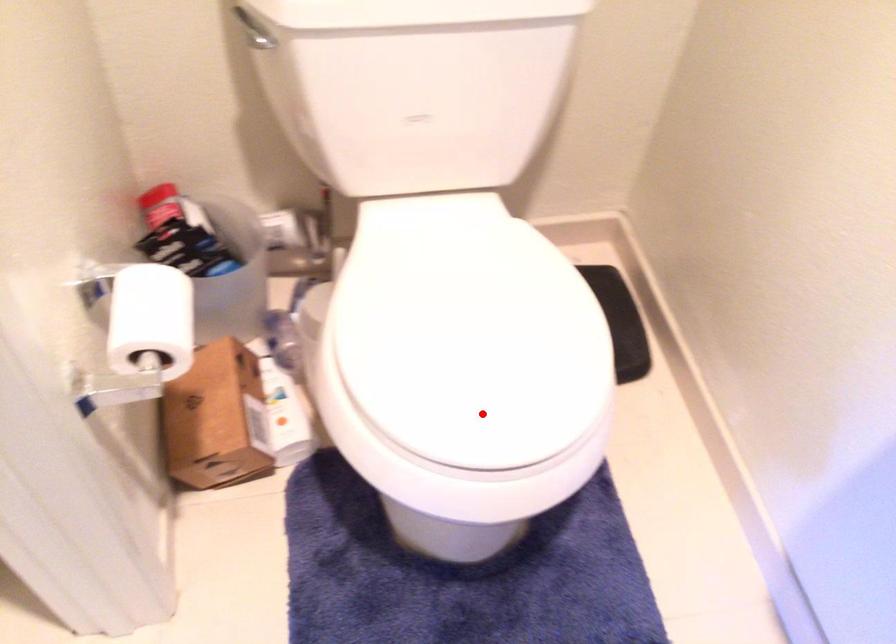
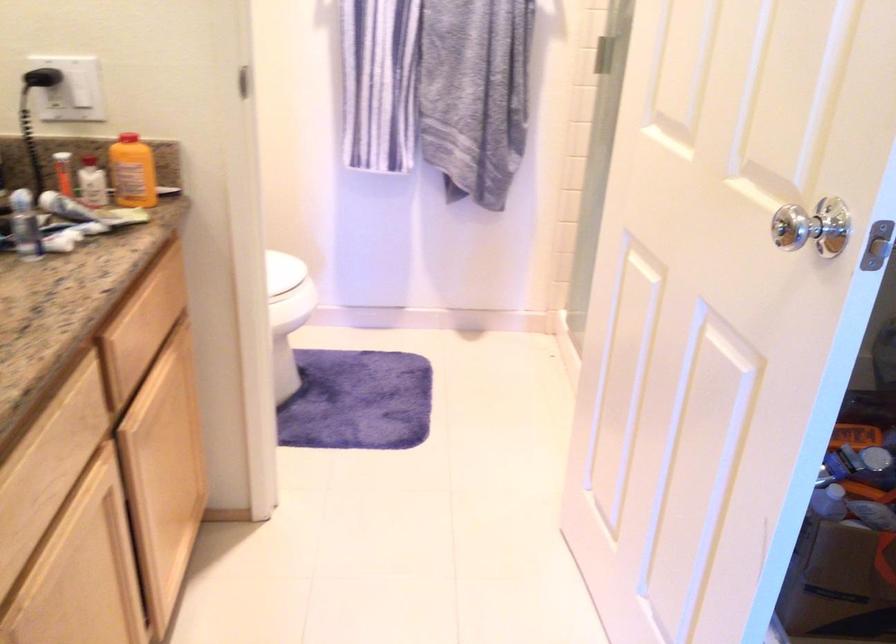
Question: I am providing you with two images of the same scene from different viewpoints. A red point is marked on the first image. Can you still see the location of the red point in image 2?

Choices:
 (A) Yes
 (B) No

Answer: (A)